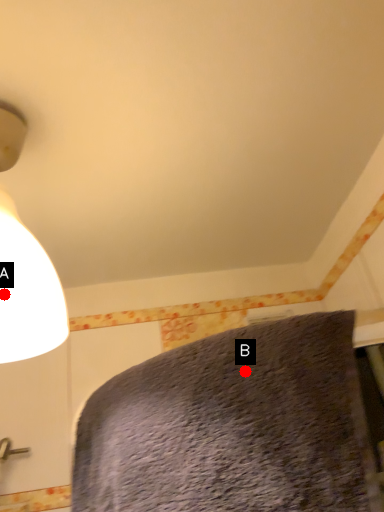
Question: Two points are circled on the image, labeled by A and B beside each circle. Which of the following is the farthest from the observer?

Choices:
 (A) A is further
 (B) B is further

Answer: (A)